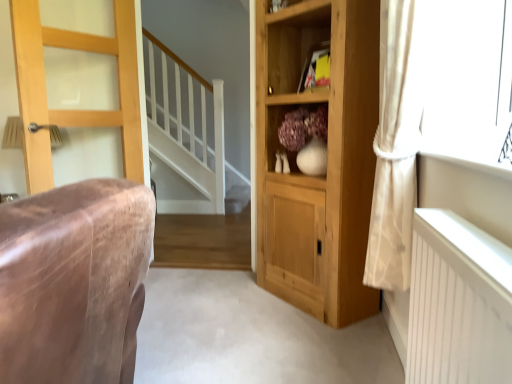
Question: Considering the relative positions of yellow paper at upper center and light brown wooden door at left in the image provided, is yellow paper at upper center to the left of light brown wooden door at left from the viewer's perspective?

Choices:
 (A) no
 (B) yes

Answer: (A)

Question: Is yellow paper at upper center not within light brown wooden door at left?

Choices:
 (A) no
 (B) yes

Answer: (B)

Question: Is yellow paper at upper center wider than light brown wooden door at left?

Choices:
 (A) yes
 (B) no

Answer: (B)

Question: From a real-world perspective, is yellow paper at upper center beneath light brown wooden door at left?

Choices:
 (A) no
 (B) yes

Answer: (A)

Question: Is yellow paper at upper center beside light brown wooden door at left?

Choices:
 (A) yes
 (B) no

Answer: (B)

Question: Is yellow paper at upper center wider or thinner than light brown wooden door at left?

Choices:
 (A) thin
 (B) wide

Answer: (A)

Question: Is yellow paper at upper center inside or outside of light brown wooden door at left?

Choices:
 (A) inside
 (B) outside

Answer: (B)

Question: Based on their positions, is yellow paper at upper center located to the left or right of light brown wooden door at left?

Choices:
 (A) left
 (B) right

Answer: (B)

Question: Based on their sizes in the image, would you say yellow paper at upper center is bigger or smaller than light brown wooden door at left?

Choices:
 (A) small
 (B) big

Answer: (A)

Question: In terms of size, does natural wood cupboard at center appear bigger or smaller than white sheer curtain at right?

Choices:
 (A) small
 (B) big

Answer: (B)

Question: Choose the correct answer: Is natural wood cupboard at center inside white sheer curtain at right or outside it?

Choices:
 (A) inside
 (B) outside

Answer: (B)

Question: Visually, is natural wood cupboard at center positioned to the left or to the right of white sheer curtain at right?

Choices:
 (A) left
 (B) right

Answer: (A)

Question: Considering their positions, is natural wood cupboard at center located in front of or behind white sheer curtain at right?

Choices:
 (A) front
 (B) behind

Answer: (B)

Question: Is light brown wooden door at left wider or thinner than white sheer curtain at right?

Choices:
 (A) thin
 (B) wide

Answer: (A)

Question: Is light brown wooden door at left situated inside white sheer curtain at right or outside?

Choices:
 (A) inside
 (B) outside

Answer: (B)